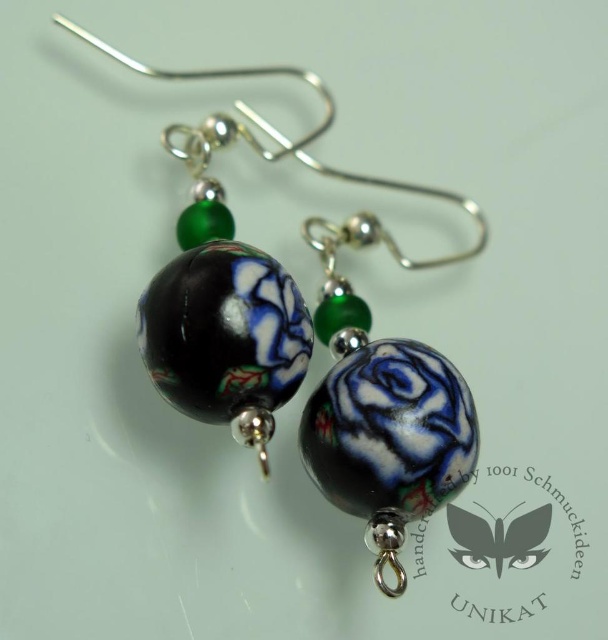
Question: Observing the image, what is the correct spatial positioning of matte black glass rose at center in reference to black glossy swirl at center?

Choices:
 (A) above
 (B) below

Answer: (A)

Question: Which of the following is the farthest from the observer?

Choices:
 (A) (530, 534)
 (B) (430, 429)

Answer: (A)

Question: Which point appears farthest from the camera in this image?

Choices:
 (A) [389, 497]
 (B) [496, 561]
 (C) [268, 68]

Answer: (C)

Question: Can you confirm if matte black ceramic rose at center is wider than black glossy swirl at center?

Choices:
 (A) no
 (B) yes

Answer: (B)

Question: Is matte black ceramic rose at center positioned at the back of black glossy swirl at center?

Choices:
 (A) no
 (B) yes

Answer: (A)

Question: Which is nearer to the matte black glass rose at center?

Choices:
 (A) black glossy swirl at center
 (B) matte black ceramic rose at center

Answer: (B)